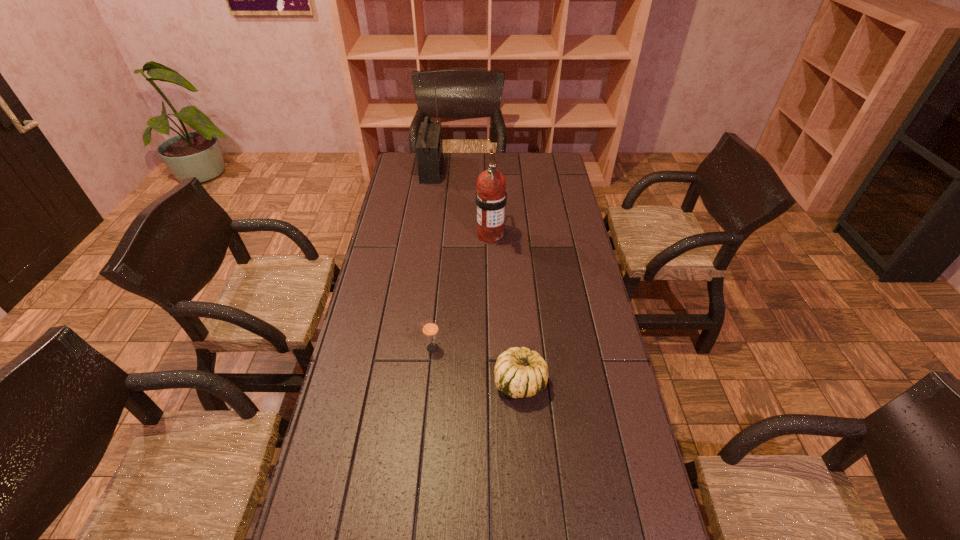
You are a GUI agent. You are given a task and a screenshot of the screen. Output one action in this format:
    pyautogui.click(x=<x>, y=<y>)
    Task: Click on the leftmost object
    The height and width of the screenshot is (540, 960).
    Given the screenshot: What is the action you would take?
    pyautogui.click(x=429, y=150)

At what (x,y) coordinates should I click in order to perform the action: click on radio receiver. Please return your answer as a coordinate pair (x, y). The height and width of the screenshot is (540, 960). Looking at the image, I should click on (429, 150).

This screenshot has width=960, height=540. What are the coordinates of `fire extinguisher` in the screenshot? It's located at (491, 197).

Find the location of a particular element. The image size is (960, 540). straw is located at coordinates click(430, 327).

The image size is (960, 540). In order to click on the second object from left to right in this screenshot , I will do `click(430, 327)`.

You are a GUI agent. You are given a task and a screenshot of the screen. Output one action in this format:
    pyautogui.click(x=<x>, y=<y>)
    Task: Click on the shortest object
    The width and height of the screenshot is (960, 540).
    Given the screenshot: What is the action you would take?
    pyautogui.click(x=519, y=372)

Locate an element on the screen. gourd is located at coordinates (519, 372).

Where is `free space located on the front panel of the leftmost object`? free space located on the front panel of the leftmost object is located at coordinates (468, 170).

You are a GUI agent. You are given a task and a screenshot of the screen. Output one action in this format:
    pyautogui.click(x=<x>, y=<y>)
    Task: Click on the vacant space situated 0.330m at the nozzle of the second farthest object
    The width and height of the screenshot is (960, 540).
    Given the screenshot: What is the action you would take?
    pyautogui.click(x=492, y=319)

At what (x,y) coordinates should I click in order to perform the action: click on vacant space located 0.150m on the left of the third farthest object. Please return your answer as a coordinate pair (x, y). This screenshot has height=540, width=960. Looking at the image, I should click on (376, 348).